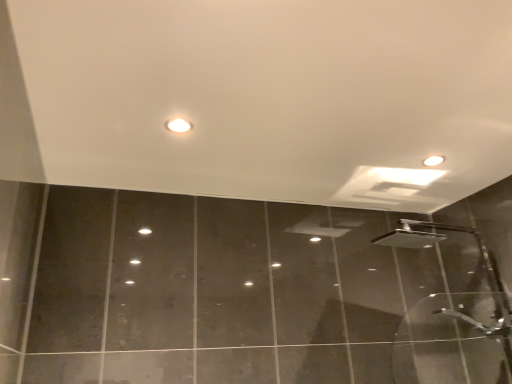
Question: From a real-world perspective, does silver metallic shower head at right sit lower than matte white droplight at upper center?

Choices:
 (A) no
 (B) yes

Answer: (B)

Question: Can you confirm if silver metallic shower head at right is taller than matte white droplight at upper center?

Choices:
 (A) yes
 (B) no

Answer: (A)

Question: Is silver metallic shower head at right touching matte white droplight at upper center?

Choices:
 (A) no
 (B) yes

Answer: (A)

Question: Is silver metallic shower head at right looking in the opposite direction of matte white droplight at upper center?

Choices:
 (A) no
 (B) yes

Answer: (A)

Question: From the image's perspective, does silver metallic shower head at right appear lower than matte white droplight at upper center?

Choices:
 (A) no
 (B) yes

Answer: (B)

Question: Considering the relative sizes of silver metallic shower head at right and matte white droplight at upper center in the image provided, is silver metallic shower head at right bigger than matte white droplight at upper center?

Choices:
 (A) yes
 (B) no

Answer: (A)

Question: Considering the relative sizes of matte white droplight at upper center and silver metallic shower head at right in the image provided, is matte white droplight at upper center smaller than silver metallic shower head at right?

Choices:
 (A) yes
 (B) no

Answer: (A)

Question: Is matte white droplight at upper center facing away from silver metallic shower head at right?

Choices:
 (A) no
 (B) yes

Answer: (A)

Question: Does matte white droplight at upper center appear on the left side of silver metallic shower head at right?

Choices:
 (A) no
 (B) yes

Answer: (B)

Question: From the image's perspective, is matte white droplight at upper center located beneath silver metallic shower head at right?

Choices:
 (A) yes
 (B) no

Answer: (B)

Question: Is silver metallic shower head at right completely or partially inside matte white droplight at upper center?

Choices:
 (A) yes
 (B) no

Answer: (B)

Question: Is the surface of matte white droplight at upper center in direct contact with silver metallic shower head at right?

Choices:
 (A) yes
 (B) no

Answer: (B)

Question: Is matte white droplight at upper center wider or thinner than silver metallic shower head at right?

Choices:
 (A) wide
 (B) thin

Answer: (B)